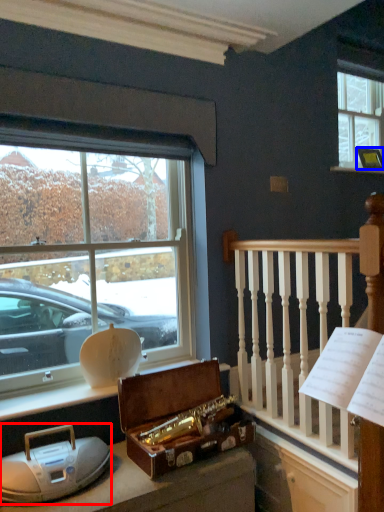
Question: Which of the following is the farthest to the observer, artifact (highlighted by a red box) or picture frame (highlighted by a blue box)?

Choices:
 (A) artifact
 (B) picture frame

Answer: (B)